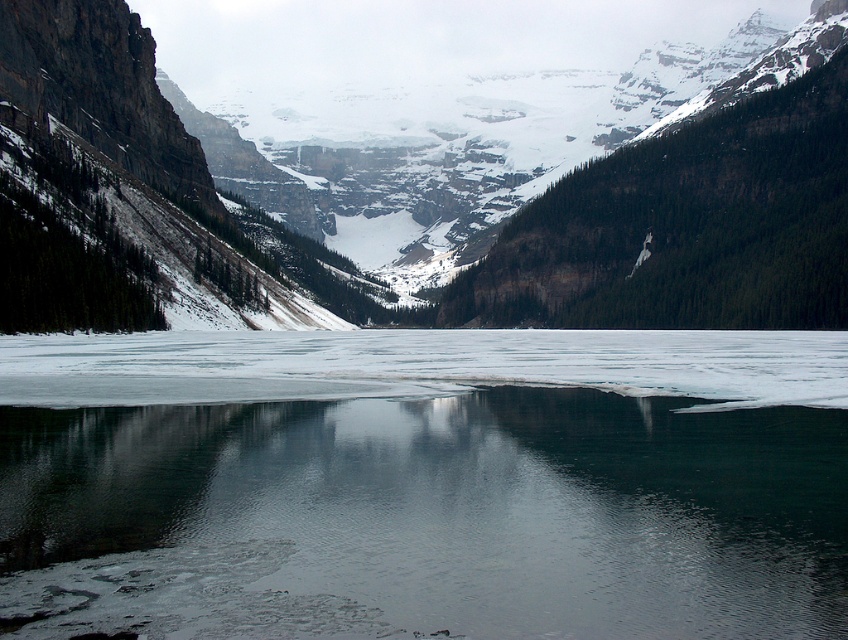
You are standing on the edge of the frozen lake and want to cross to the other side. The clear ice at center is 187.44 meters from you. If your maximum walking distance is 200 meters, can you safely reach the other side of the lake without exceeding your limit?

The clear ice at center is 187.44 meters from viewer, so yes, you can safely reach the other side of the lake as the distance is within your 200 meters maximum walking limit.

You are an ice skater planning to glide across the frozen lake. You notice the clear ice at center and the snowy rock mountain at center in the distance. Which feature has a smaller width in the image?

The clear ice at center has a smaller width than the snowy rock mountain at center according to the description.